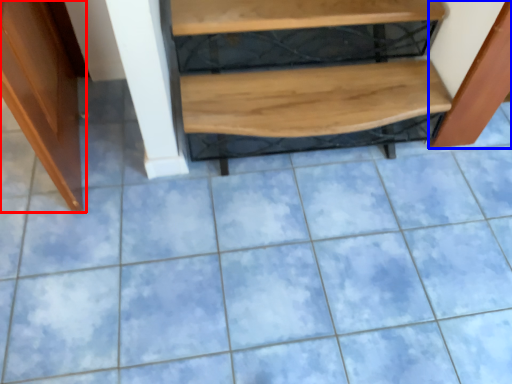
Question: Which of the following is the closest to the observer, furniture (highlighted by a red box) or cabinetry (highlighted by a blue box)?

Choices:
 (A) furniture
 (B) cabinetry

Answer: (A)